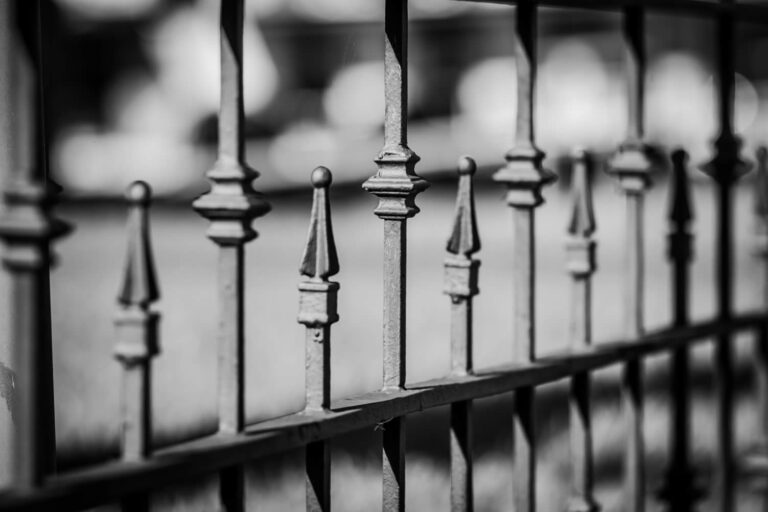
Locate an element on the screen. rod is located at coordinates (399, 366).